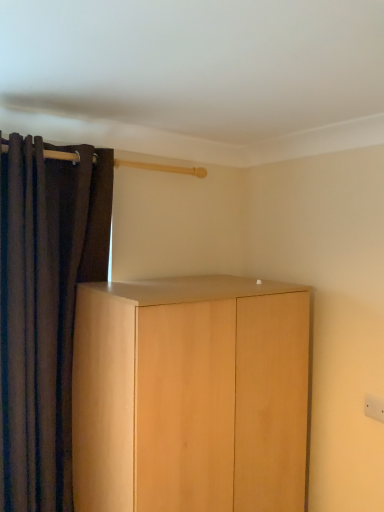
Question: From a real-world perspective, is light wood cabinet at center positioned above or below brown velvet curtain at left?

Choices:
 (A) above
 (B) below

Answer: (B)

Question: Would you say light wood cabinet at center is to the left or to the right of brown velvet curtain at left in the picture?

Choices:
 (A) right
 (B) left

Answer: (A)

Question: Is point (200, 416) closer or farther from the camera than point (29, 144)?

Choices:
 (A) closer
 (B) farther

Answer: (A)

Question: From a real-world perspective, is brown velvet curtain at left positioned above or below light wood cabinet at center?

Choices:
 (A) above
 (B) below

Answer: (A)

Question: Is brown velvet curtain at left bigger or smaller than light wood cabinet at center?

Choices:
 (A) big
 (B) small

Answer: (B)

Question: From their relative heights in the image, would you say brown velvet curtain at left is taller or shorter than light wood cabinet at center?

Choices:
 (A) tall
 (B) short

Answer: (A)

Question: In the image, is brown velvet curtain at left on the left side or the right side of light wood cabinet at center?

Choices:
 (A) right
 (B) left

Answer: (B)